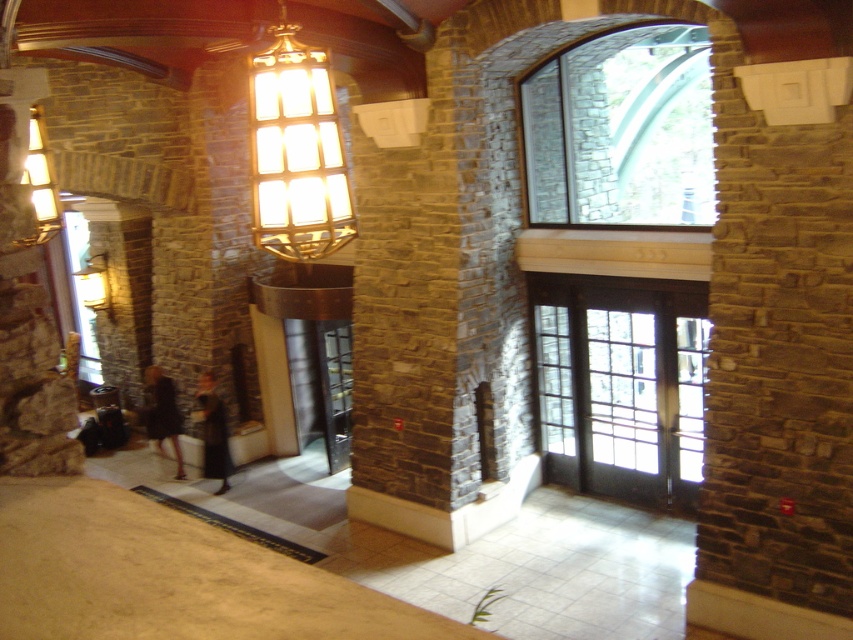
You are standing in the lobby and want to reach the point marked at coordinates (699, 193). Given that the lobby is 30 feet long, can you estimate whether you are closer to the entrance or the point?

The point marked at coordinates (699, 193) is 24.17 feet away from you. Since the lobby is 30 feet long, you are closer to the entrance than the point because the distance to the point is less than half the lobby length.

You are a guest entering the lobby and see the glass door at center and the dark brown dress at lower left. Which object is smaller in size?

The glass door at center is smaller in size compared to the dark brown dress at lower left according to the description.